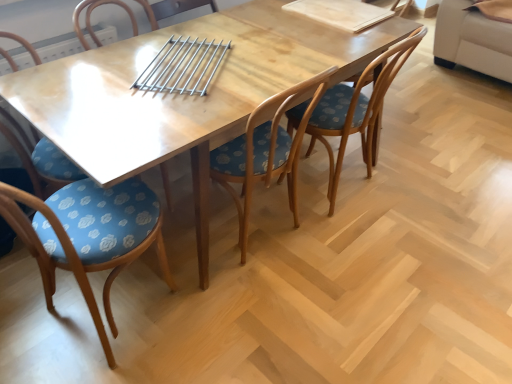
This screenshot has width=512, height=384. I want to click on free region under blue fabric chair at center, marked as the second chair in a left-to-right arrangement (from a real-world perspective), so click(x=94, y=328).